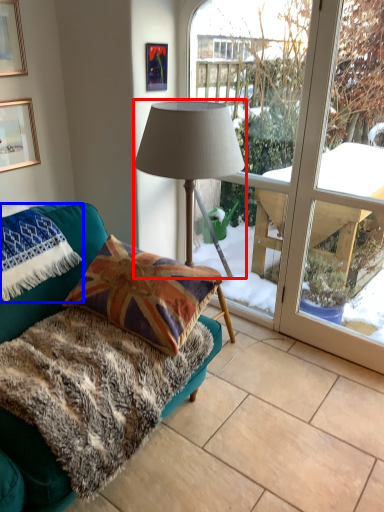
Question: Which point is closer to the camera, lamp (highlighted by a red box) or blanket (highlighted by a blue box)?

Choices:
 (A) lamp
 (B) blanket

Answer: (A)